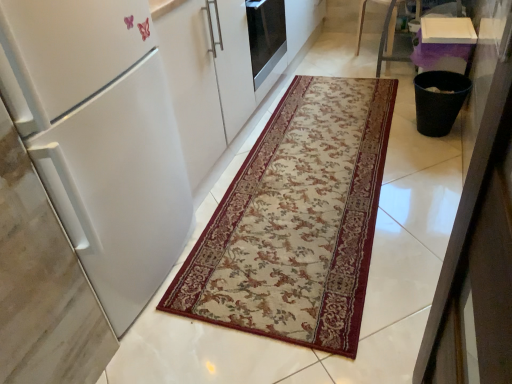
Question: From the image's perspective, is white matte refrigerator at left beneath beige floral rug at center?

Choices:
 (A) no
 (B) yes

Answer: (B)

Question: Is white matte refrigerator at left bigger than beige floral rug at center?

Choices:
 (A) no
 (B) yes

Answer: (B)

Question: From a real-world perspective, is white matte refrigerator at left over beige floral rug at center?

Choices:
 (A) yes
 (B) no

Answer: (A)

Question: Can you confirm if white matte refrigerator at left is smaller than beige floral rug at center?

Choices:
 (A) no
 (B) yes

Answer: (A)

Question: Is white matte refrigerator at left positioned with its back to beige floral rug at center?

Choices:
 (A) yes
 (B) no

Answer: (B)

Question: From a real-world perspective, is white matte refrigerator at left physically below beige floral rug at center?

Choices:
 (A) no
 (B) yes

Answer: (A)

Question: From a real-world perspective, is beige floral rug at center on top of white matte refrigerator at left?

Choices:
 (A) yes
 (B) no

Answer: (B)

Question: Considering the relative sizes of beige floral rug at center and white matte refrigerator at left in the image provided, is beige floral rug at center taller than white matte refrigerator at left?

Choices:
 (A) yes
 (B) no

Answer: (B)

Question: Considering the relative sizes of beige floral rug at center and white matte refrigerator at left in the image provided, is beige floral rug at center bigger than white matte refrigerator at left?

Choices:
 (A) no
 (B) yes

Answer: (A)

Question: Does beige floral rug at center appear on the left side of white matte refrigerator at left?

Choices:
 (A) yes
 (B) no

Answer: (B)

Question: Is white matte refrigerator at left at the back of beige floral rug at center?

Choices:
 (A) yes
 (B) no

Answer: (B)

Question: From a real-world perspective, does beige floral rug at center sit lower than white matte refrigerator at left?

Choices:
 (A) yes
 (B) no

Answer: (A)

Question: Considering the positions of point (311, 144) and point (138, 3), is point (311, 144) closer or farther from the camera than point (138, 3)?

Choices:
 (A) closer
 (B) farther

Answer: (B)